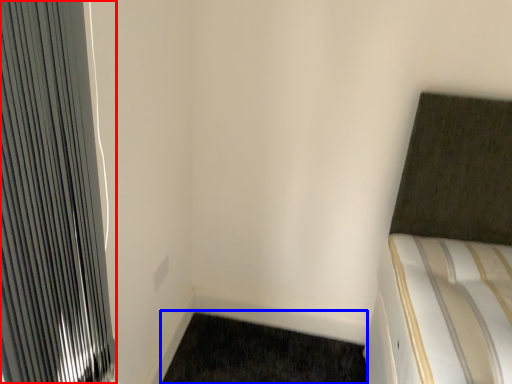
Question: Among these objects, which one is nearest to the camera, radiator (highlighted by a red box) or doormat (highlighted by a blue box)?

Choices:
 (A) radiator
 (B) doormat

Answer: (A)